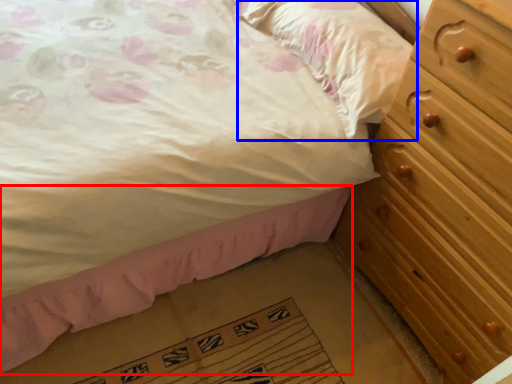
Question: Which point is further to the camera, bed frame (highlighted by a red box) or pillow (highlighted by a blue box)?

Choices:
 (A) bed frame
 (B) pillow

Answer: (B)